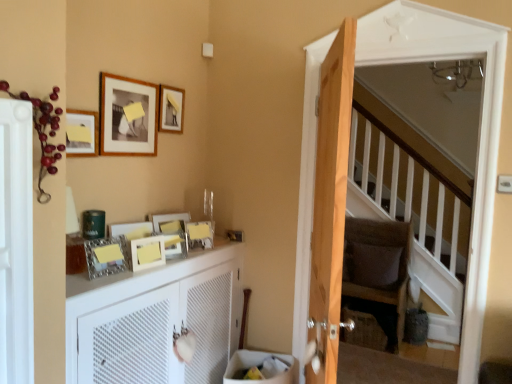
The image size is (512, 384). I want to click on blank space situated above brown fabric pillow at center (from a real-world perspective), so click(377, 235).